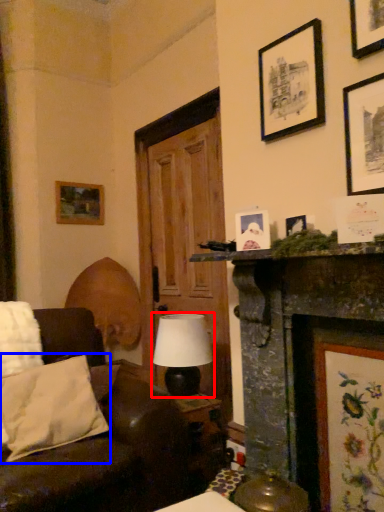
Question: Which object appears farthest to the camera in this image, table lamp (highlighted by a red box) or pillow (highlighted by a blue box)?

Choices:
 (A) table lamp
 (B) pillow

Answer: (A)